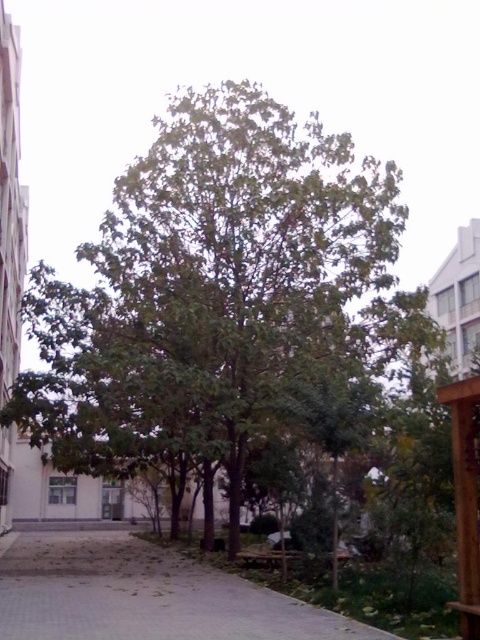
Question: Is green leafy tree at center positioned at the back of gray concrete pavement at lower center?

Choices:
 (A) no
 (B) yes

Answer: (B)

Question: Does green leafy tree at center appear on the right side of gray concrete pavement at lower center?

Choices:
 (A) no
 (B) yes

Answer: (B)

Question: Which object appears closest to the camera in this image?

Choices:
 (A) green leafy tree at center
 (B) gray concrete pavement at lower center

Answer: (B)

Question: Can you confirm if green leafy tree at center is positioned below gray concrete pavement at lower center?

Choices:
 (A) no
 (B) yes

Answer: (A)

Question: Which of the following is the closest to the observer?

Choices:
 (A) (200, 632)
 (B) (237, 381)

Answer: (A)

Question: Among these points, which one is farthest from the camera?

Choices:
 (A) (333, 259)
 (B) (362, 636)

Answer: (A)